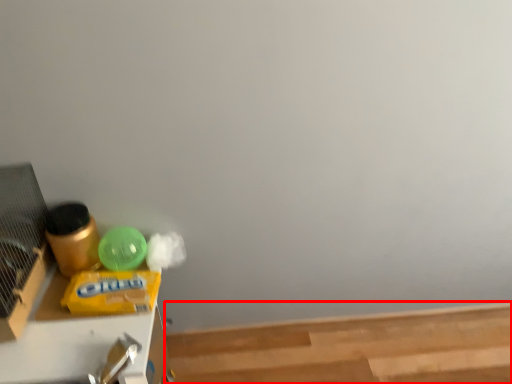
Question: From the image's perspective, considering the relative positions of wood (annotated by the red box) and furniture in the image provided, where is wood (annotated by the red box) located with respect to the staircase?

Choices:
 (A) above
 (B) below

Answer: (B)